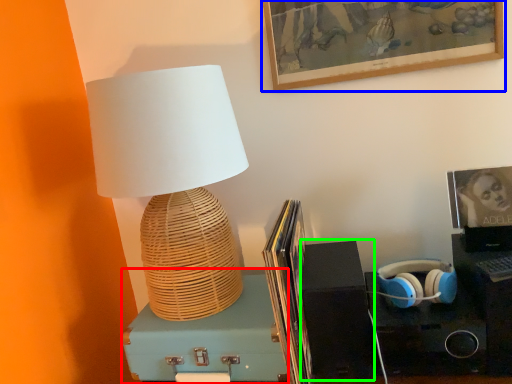
Question: Which is farther away from box (highlighted by a red box)? picture frame (highlighted by a blue box) or speaker (highlighted by a green box)?

Choices:
 (A) picture frame
 (B) speaker

Answer: (A)